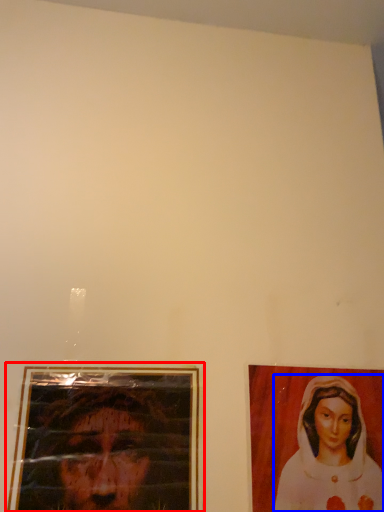
Question: Which of the following is the closest to the observer, picture frame (highlighted by a red box) or woman (highlighted by a blue box)?

Choices:
 (A) picture frame
 (B) woman

Answer: (A)